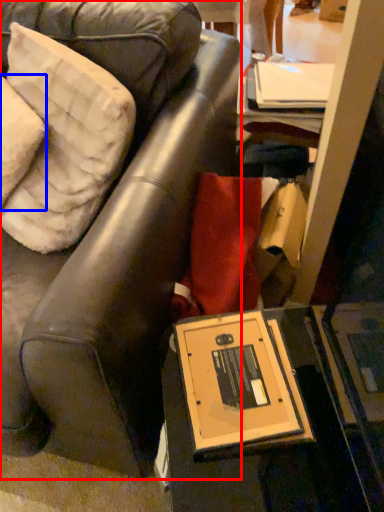
Question: Among these objects, which one is farthest to the camera, chair (highlighted by a red box) or pillow (highlighted by a blue box)?

Choices:
 (A) chair
 (B) pillow

Answer: (B)